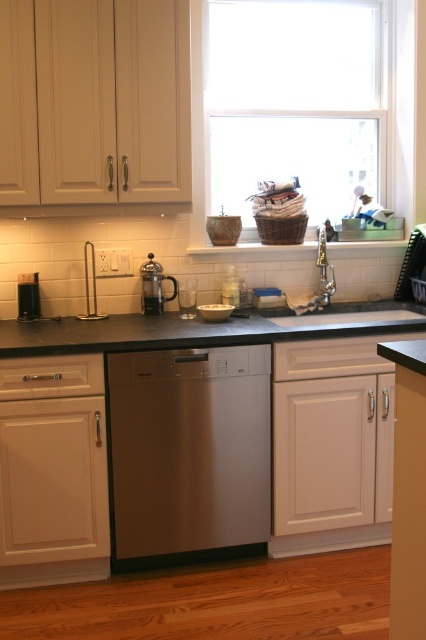
Is white porcelain sink at center thinner than satin silver french press at center?

No.

Describe the element at coordinates (353, 316) in the screenshot. I see `white porcelain sink at center` at that location.

Where is `white porcelain sink at center`? white porcelain sink at center is located at coordinates (353, 316).

Does stainless steel dishwasher at center appear on the left side of black granite countertop at center?

Indeed, stainless steel dishwasher at center is positioned on the left side of black granite countertop at center.

Is point (161, 426) positioned behind point (69, 339)?

Yes, it is behind point (69, 339).

This screenshot has width=426, height=640. What do you see at coordinates (189, 451) in the screenshot? I see `stainless steel dishwasher at center` at bounding box center [189, 451].

Find the location of a particular element. Image resolution: width=426 pixels, height=640 pixels. stainless steel dishwasher at center is located at coordinates (189, 451).

Which is in front, point (233, 161) or point (382, 308)?

Positioned in front is point (382, 308).

Does point (356, 115) lie in front of point (305, 321)?

No, it is not.

Image resolution: width=426 pixels, height=640 pixels. I want to click on white matte window at upper center, so click(x=287, y=102).